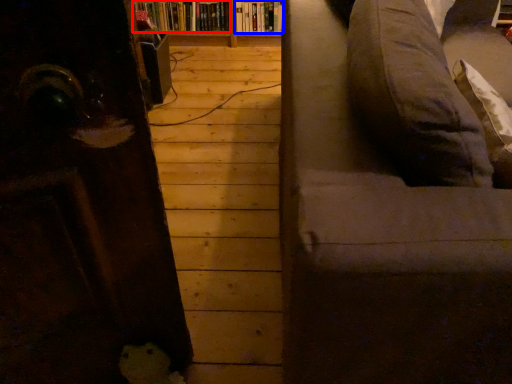
Question: Among these objects, which one is nearest to the camera, book (highlighted by a red box) or book (highlighted by a blue box)?

Choices:
 (A) book
 (B) book

Answer: (B)